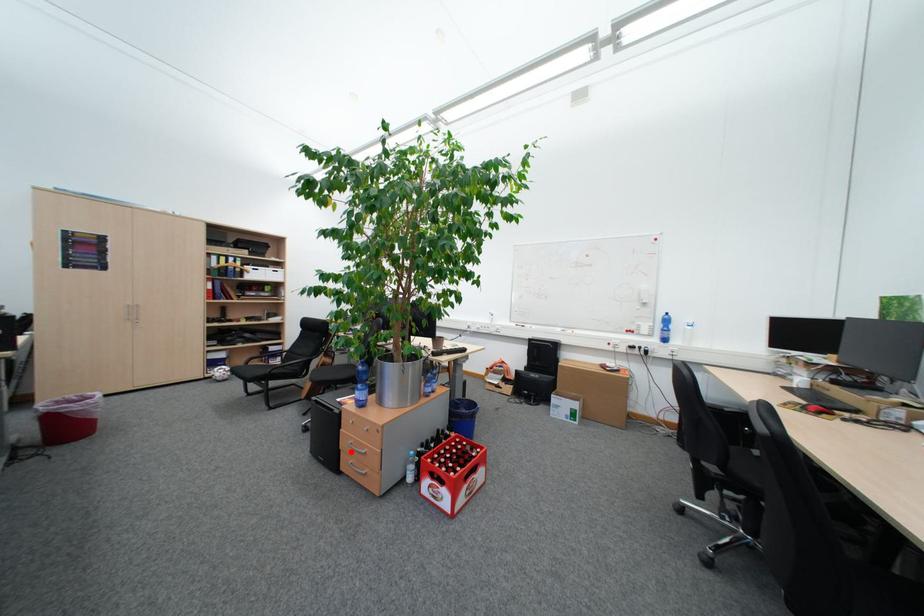
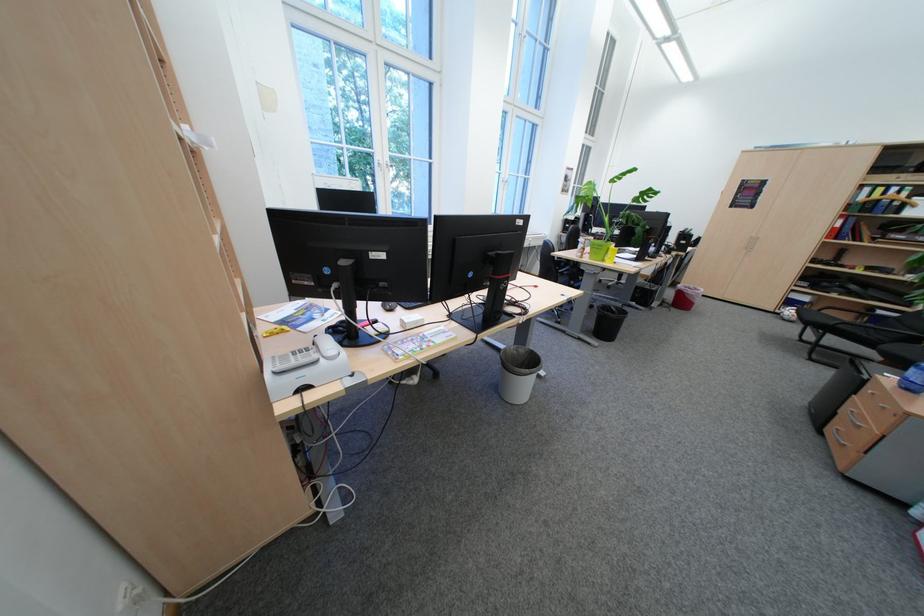
The point at the highlighted location is marked in the first image. Where is the corresponding point in the second image?

(847, 414)